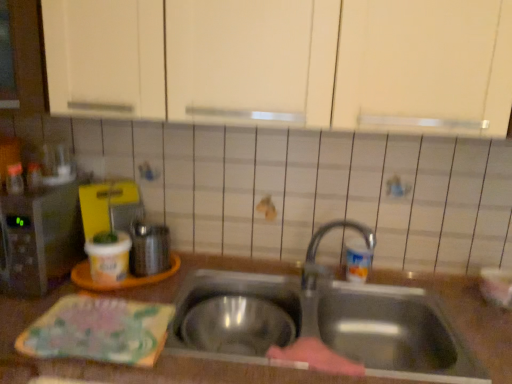
Question: Is point (480, 349) positioned closer to the camera than point (65, 259)?

Choices:
 (A) closer
 (B) farther

Answer: (A)

Question: Looking at the image, does brown matte countertop at center seem bigger or smaller compared to metallic microwave at left, the second appliance positioned from the right?

Choices:
 (A) big
 (B) small

Answer: (A)

Question: Considering the real-world distances, which object is closest to the shiny metallic kettle at left, the 2th appliance when ordered from left to right?

Choices:
 (A) stainless steel sink at center
 (B) brown matte countertop at center
 (C) metallic microwave at left, the second appliance positioned from the right

Answer: (C)

Question: Estimate the real-world distances between objects in this image. Which object is farther from the metallic microwave at left, marked as the first appliance in a left-to-right arrangement?

Choices:
 (A) shiny metallic kettle at left, which ranks as the first appliance in right-to-left order
 (B) stainless steel sink at center
 (C) brown matte countertop at center

Answer: (B)